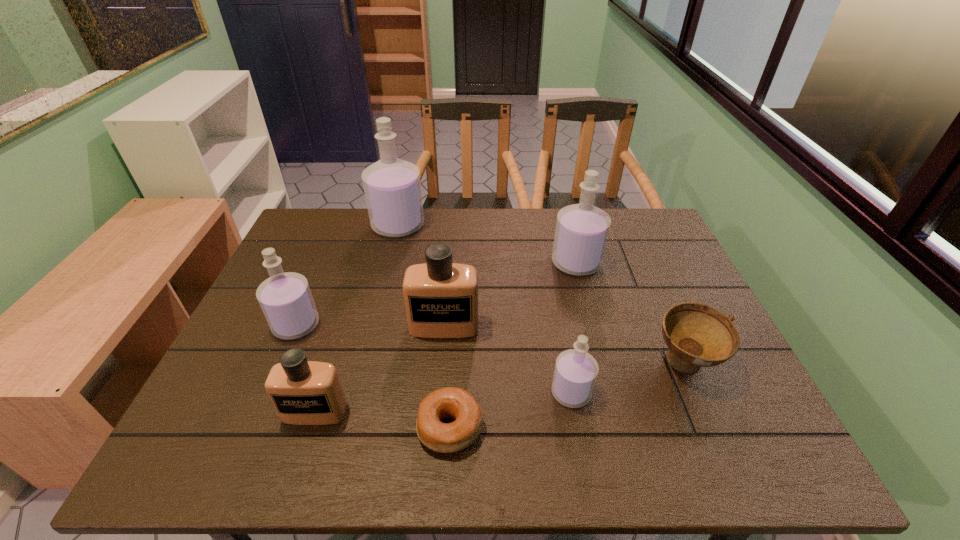
Image resolution: width=960 pixels, height=540 pixels. Find the location of `perfume that is the closest to the nearest purple perfume`. perfume that is the closest to the nearest purple perfume is located at coordinates (441, 298).

Where is `perfume that can be found as the fifth closest to the smallest purple perfume`? This screenshot has width=960, height=540. perfume that can be found as the fifth closest to the smallest purple perfume is located at coordinates (392, 186).

Select which purple perfume is the fourth closest to the seventh tallest object. Please provide its 2D coordinates. Your answer should be formatted as a tuple, i.e. [(x, y)], where the tuple contains the x and y coordinates of a point satisfying the conditions above.

[(286, 300)]

Point out which purple perfume is positioned as the nearest to the nearer beige perfume. Please provide its 2D coordinates. Your answer should be formatted as a tuple, i.e. [(x, y)], where the tuple contains the x and y coordinates of a point satisfying the conditions above.

[(286, 300)]

Image resolution: width=960 pixels, height=540 pixels. I want to click on free space that satisfies the following two spatial constraints: 1. on the front side of the rightmost object; 2. on the right side of the seventh nearest object, so click(603, 366).

Find the location of a particular element. Image resolution: width=960 pixels, height=540 pixels. blank area in the image that satisfies the following two spatial constraints: 1. on the back side of the second farthest object; 2. on the left side of the third farthest purple perfume is located at coordinates (323, 263).